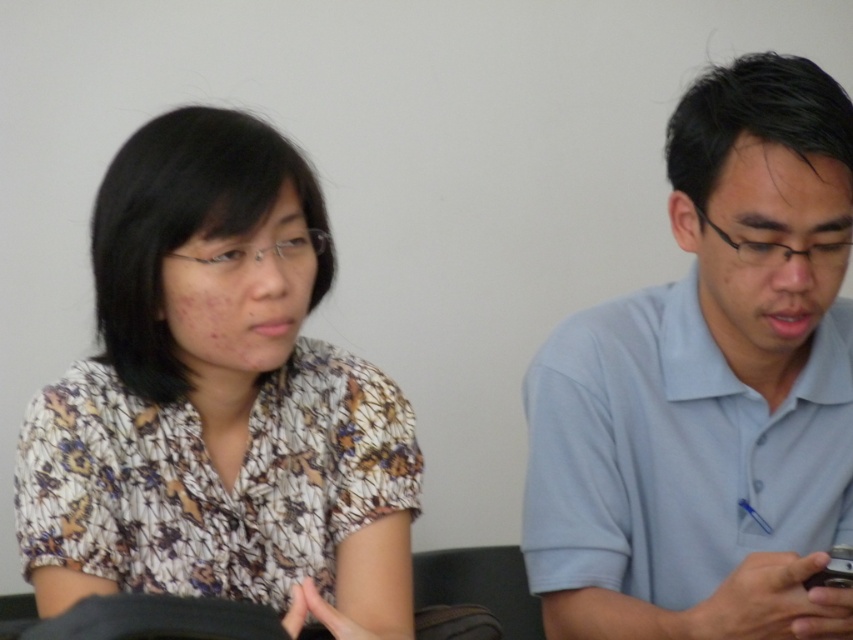
Between point (231, 400) and point (798, 454), which one is positioned behind?

The point (798, 454) is behind.

Looking at this image, does floral fabric blouse at left come behind light blue cotton shirt at right?

That is False.

What do you see at coordinates (218, 401) in the screenshot? I see `floral fabric blouse at left` at bounding box center [218, 401].

Identify the location of floral fabric blouse at left. The width and height of the screenshot is (853, 640). (218, 401).